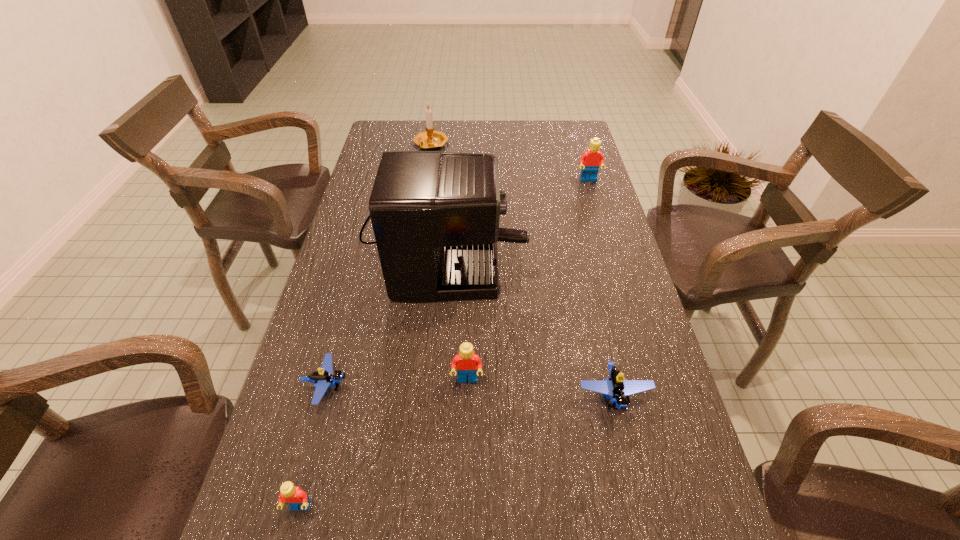
You are a GUI agent. You are given a task and a screenshot of the screen. Output one action in this format:
    pyautogui.click(x=<x>, y=<y>)
    Task: Click on the free space in the image that satisfies the following two spatial constraints: 1. on the face of the second nearest red Lego; 2. on the front-facing side of the shortest Lego
    The image size is (960, 540).
    Given the screenshot: What is the action you would take?
    tap(468, 386)

Locate an element on the screen. vacant position in the image that satisfies the following two spatial constraints: 1. on the face of the fourth shortest Lego; 2. on the front-facing side of the shortest Lego is located at coordinates (468, 386).